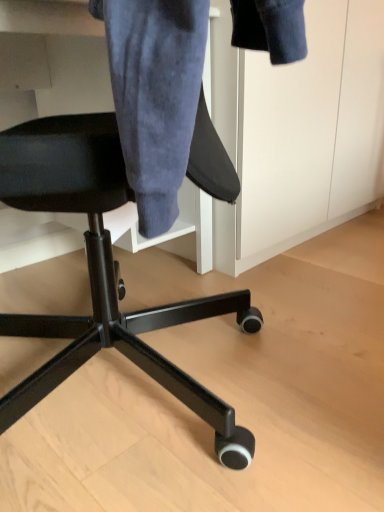
In order to face denim jacket at upper center, should I rotate leftwards or rightwards?

Rotate your view right by about 9.696°.

Image resolution: width=384 pixels, height=512 pixels. Identify the location of denim jacket at upper center. (155, 95).

Describe the element at coordinates (155, 95) in the screenshot. I see `denim jacket at upper center` at that location.

This screenshot has height=512, width=384. What do you see at coordinates (103, 272) in the screenshot? I see `black fabric chair at center` at bounding box center [103, 272].

What is the approximate width of black fabric chair at center?

It is 26.53 inches.

This screenshot has height=512, width=384. Identify the location of black fabric chair at center. (103, 272).

In order to click on denim jacket at upper center in this screenshot , I will do tap(155, 95).

Does denim jacket at upper center appear on the left side of black fabric chair at center?

Incorrect, denim jacket at upper center is not on the left side of black fabric chair at center.

Between denim jacket at upper center and black fabric chair at center, which one is positioned in front?

black fabric chair at center is closer to the camera.

Which is closer to the camera, (x=187, y=116) or (x=7, y=411)?

Point (x=187, y=116) is closer to the camera than point (x=7, y=411).

From the image's perspective, between denim jacket at upper center and black fabric chair at center, which one is located above?

From the image's view, denim jacket at upper center is above.

From a real-world perspective, is denim jacket at upper center positioned under black fabric chair at center based on gravity?

Incorrect, from a real-world perspective, denim jacket at upper center is higher than black fabric chair at center.

Is denim jacket at upper center wider than black fabric chair at center?

No.

Does denim jacket at upper center have a greater height compared to black fabric chair at center?

Yes.

In terms of size, does denim jacket at upper center appear bigger or smaller than black fabric chair at center?

Considering their sizes, denim jacket at upper center takes up more space than black fabric chair at center.

Is black fabric chair at center located within denim jacket at upper center?

Actually, black fabric chair at center is outside denim jacket at upper center.

Is denim jacket at upper center not near black fabric chair at center?

No, denim jacket at upper center is in close proximity to black fabric chair at center.

Is denim jacket at upper center turned away from black fabric chair at center?

No, denim jacket at upper center's orientation is not away from black fabric chair at center.

What's the angular difference between denim jacket at upper center and black fabric chair at center's facing directions?

The angular difference between denim jacket at upper center and black fabric chair at center is 143 degrees.

Find the location of `denim jacket behind the black fabric chair at center`. denim jacket behind the black fabric chair at center is located at coordinates (155, 95).

Which is more to the left, black fabric chair at center or denim jacket at upper center?

black fabric chair at center.

Does black fabric chair at center lie behind denim jacket at upper center?

No, the depth of black fabric chair at center is less than that of denim jacket at upper center.

Considering the positions of point (227, 176) and point (113, 14), is point (227, 176) closer or farther from the camera than point (113, 14)?

Clearly, point (227, 176) is more distant from the camera than point (113, 14).

From the image's perspective, between black fabric chair at center and denim jacket at upper center, who is located below?

black fabric chair at center appears lower in the image.

From a real-world perspective, is black fabric chair at center physically located above or below denim jacket at upper center?

black fabric chair at center is situated lower than denim jacket at upper center in the real world.

Is black fabric chair at center wider or thinner than denim jacket at upper center?

In the image, black fabric chair at center appears to be wider than denim jacket at upper center.

Considering the sizes of black fabric chair at center and denim jacket at upper center in the image, is black fabric chair at center taller or shorter than denim jacket at upper center?

Considering their sizes, black fabric chair at center has less height than denim jacket at upper center.

Based on the photo, considering the sizes of objects black fabric chair at center and denim jacket at upper center in the image provided, who is bigger, black fabric chair at center or denim jacket at upper center?

Bigger between the two is denim jacket at upper center.

Is black fabric chair at center not within denim jacket at upper center?

Absolutely, black fabric chair at center is external to denim jacket at upper center.

Are black fabric chair at center and denim jacket at upper center located far from each other?

No, black fabric chair at center is in close proximity to denim jacket at upper center.

Is black fabric chair at center aimed at denim jacket at upper center?

No, black fabric chair at center does not turn towards denim jacket at upper center.

Can you tell me how much black fabric chair at center and denim jacket at upper center differ in facing direction?

The angular difference between black fabric chair at center and denim jacket at upper center is 143 degrees.

You are a GUI agent. You are given a task and a screenshot of the screen. Output one action in this format:
    pyautogui.click(x=<x>, y=<y>)
    Task: Click on the chair in front of the denim jacket at upper center
    The width and height of the screenshot is (384, 512).
    Given the screenshot: What is the action you would take?
    pyautogui.click(x=103, y=272)

Where is `denim jacket on the right of black fabric chair at center`? This screenshot has width=384, height=512. denim jacket on the right of black fabric chair at center is located at coordinates (155, 95).

Locate an element on the screen. chair that appears below the denim jacket at upper center (from a real-world perspective) is located at coordinates (x=103, y=272).